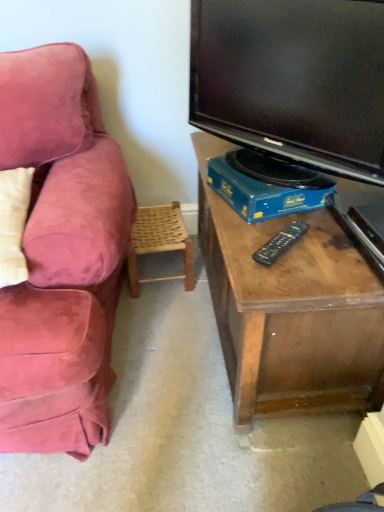
Question: Based on their sizes in the image, would you say blue cardboard box at lower center is bigger or smaller than woven wood chair at lower center?

Choices:
 (A) small
 (B) big

Answer: (A)

Question: Is blue cardboard box at lower center wider or thinner than woven wood chair at lower center?

Choices:
 (A) thin
 (B) wide

Answer: (A)

Question: Considering the real-world distances, which object is farthest from the blue cardboard box at lower center?

Choices:
 (A) woven wood chair at lower center
 (B) black plastic remote at center
 (C) black glossy tv at upper right

Answer: (A)

Question: Based on their relative distances, which object is farther from the black plastic remote at center?

Choices:
 (A) woven wood chair at lower center
 (B) black glossy tv at upper right
 (C) blue cardboard box at lower center

Answer: (A)